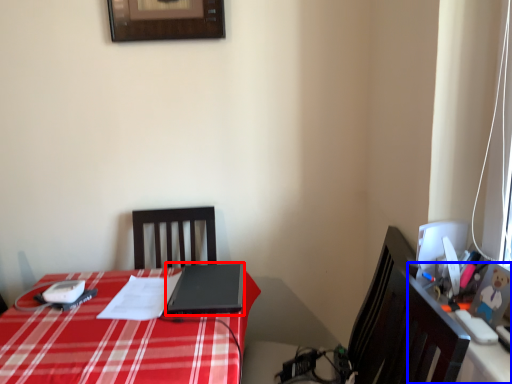
Question: Which object is further to the camera taking this photo, laptop (highlighted by a red box) or computer desk (highlighted by a blue box)?

Choices:
 (A) laptop
 (B) computer desk

Answer: (A)